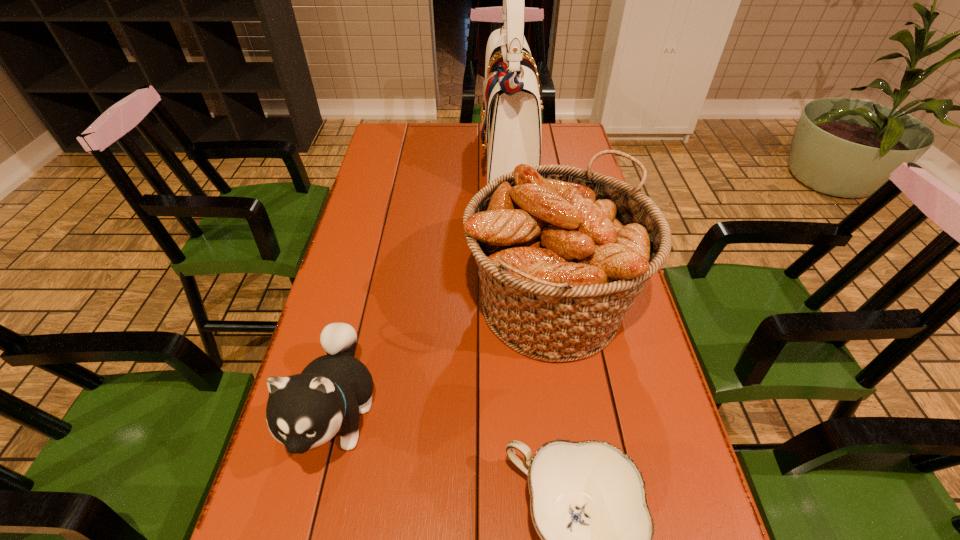
The image size is (960, 540). I want to click on object situated at the far edge, so coord(511,113).

Identify the location of object situated at the left edge. (304, 411).

Image resolution: width=960 pixels, height=540 pixels. In order to click on object that is at the right edge in this screenshot , I will do `click(562, 252)`.

The height and width of the screenshot is (540, 960). In the image, there is a desktop. Find the location of `vacant space at the far edge`. vacant space at the far edge is located at coordinates (460, 135).

This screenshot has width=960, height=540. Identify the location of vacant region at the left edge of the desktop. [x=364, y=210].

I want to click on vacant space at the far left corner of the desktop, so click(382, 153).

This screenshot has width=960, height=540. I want to click on free location at the far right corner of the desktop, so click(x=570, y=132).

The image size is (960, 540). In order to click on free spot between the basket and the third tallest object in this screenshot , I will do `click(444, 360)`.

Find the location of `vacant space that is in between the third tallest object and the satchel`. vacant space that is in between the third tallest object and the satchel is located at coordinates (423, 286).

This screenshot has height=540, width=960. Find the location of `free space that is in between the second shortest object and the third shortest object`. free space that is in between the second shortest object and the third shortest object is located at coordinates coord(444,360).